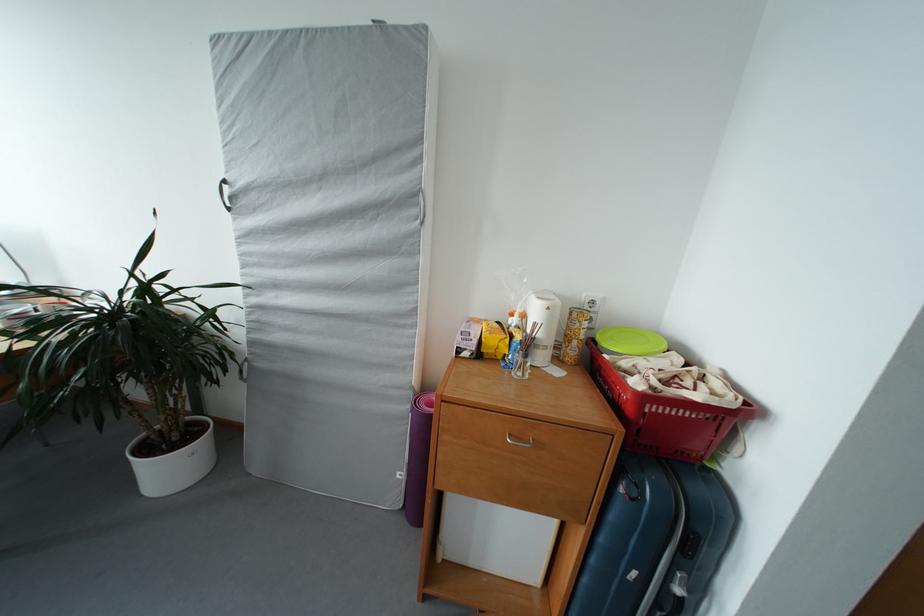
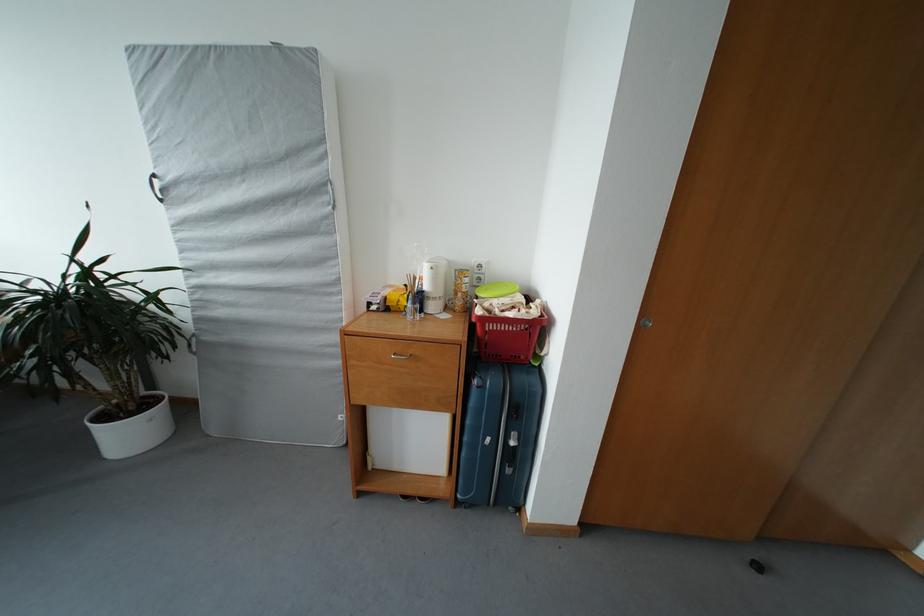
Find the pixel in the second image that matches pixel 552 352 in the first image.

(441, 304)